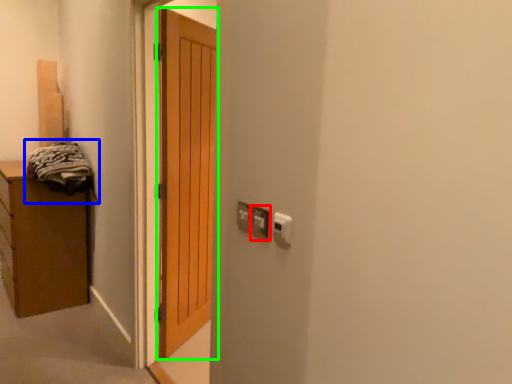
Question: Which object is positioned farthest from electric outlet (highlighted by a red box)? Select from laundry (highlighted by a blue box) and door (highlighted by a green box).

Choices:
 (A) laundry
 (B) door

Answer: (A)